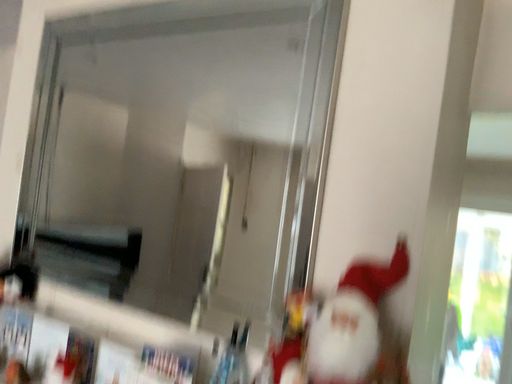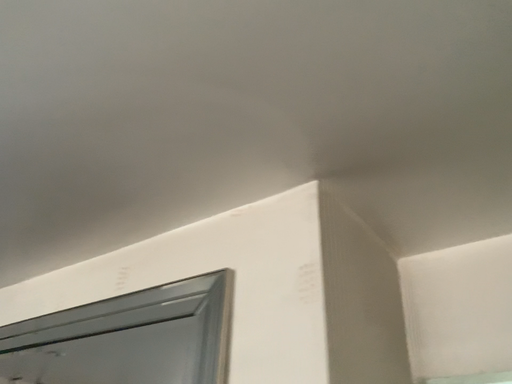
Question: Which way did the camera rotate in the video?

Choices:
 (A) rotated downward
 (B) rotated upward

Answer: (B)